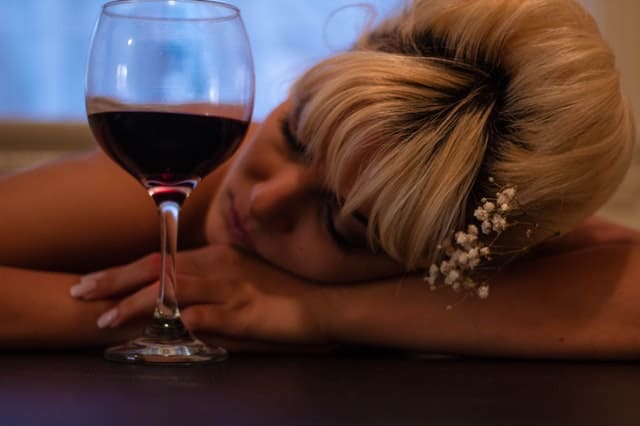
The image size is (640, 426). In order to click on bluish blurred light coming in from window in this screenshot , I will do `click(49, 46)`.